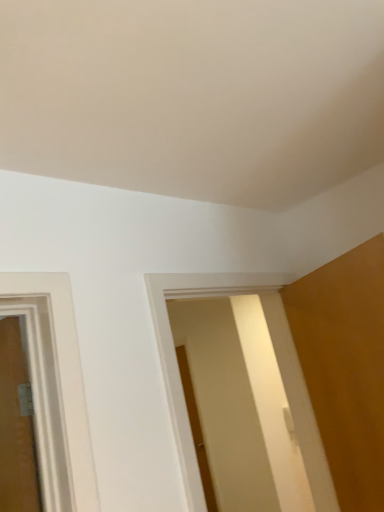
This screenshot has height=512, width=384. I want to click on matte brown door at center, so click(x=196, y=429).

This screenshot has width=384, height=512. What do you see at coordinates (196, 429) in the screenshot?
I see `matte brown door at center` at bounding box center [196, 429].

The width and height of the screenshot is (384, 512). I want to click on matte brown door at center, so click(x=196, y=429).